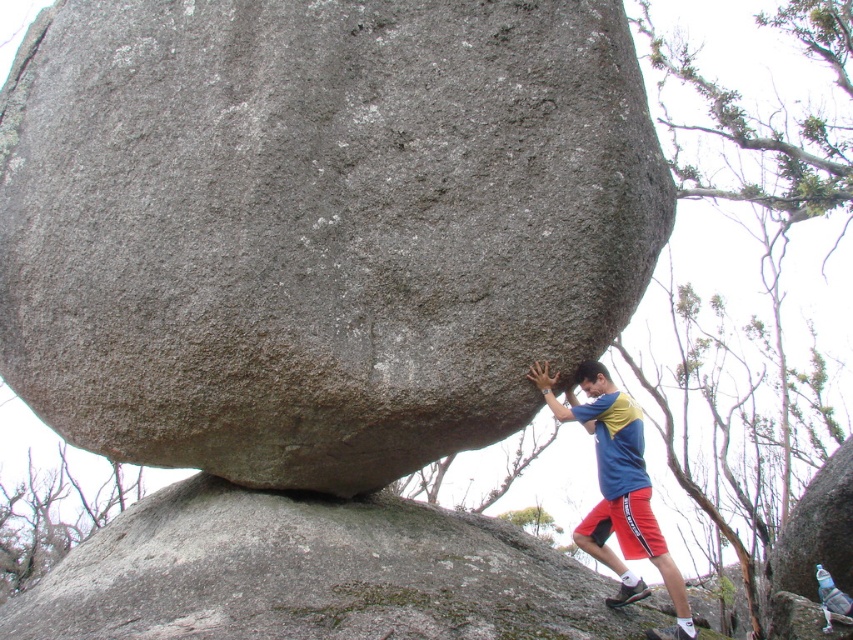
Question: Does gray rough rock at center have a lesser width compared to blue/yellow t-shirt at center?

Choices:
 (A) yes
 (B) no

Answer: (B)

Question: Can you confirm if gray rough rock at center is smaller than blue/yellow t-shirt at center?

Choices:
 (A) yes
 (B) no

Answer: (B)

Question: Which of the following is the closest to the observer?

Choices:
 (A) (619, 468)
 (B) (581, 68)

Answer: (B)

Question: Where is gray rough rock at center located in relation to blue/yellow t-shirt at center in the image?

Choices:
 (A) below
 (B) above

Answer: (B)

Question: Which point is closer to the camera?

Choices:
 (A) (613, 484)
 (B) (630, 180)

Answer: (B)